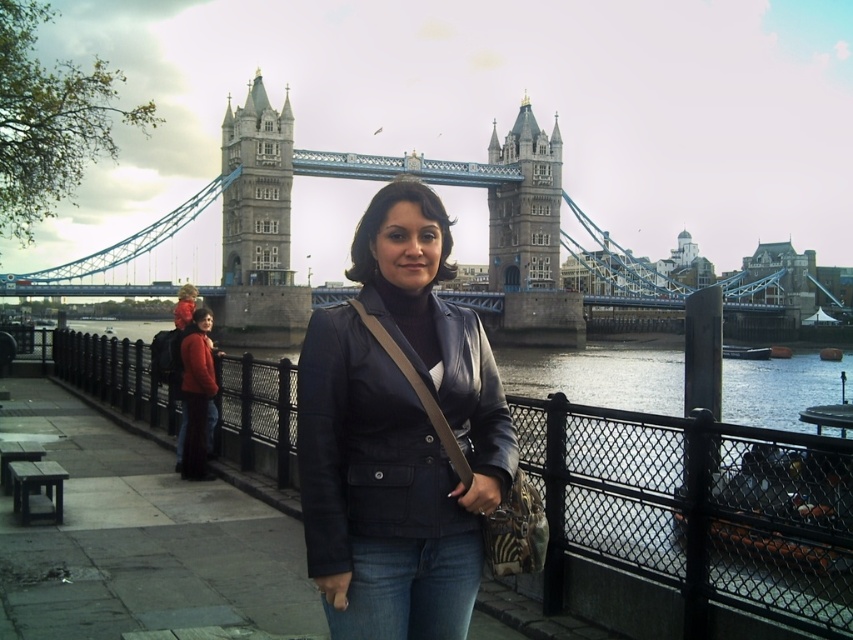
You are standing on the walkway at Tower Bridge and want to take a photo of the stone tower at center. There is a person wearing a matte black jacket at center in front of you. Will the person block your view of the tower?

The matte black jacket at center is closer to the viewer than the stone tower at center, so the person wearing the matte black jacket at center will block your view of the stone tower at center.